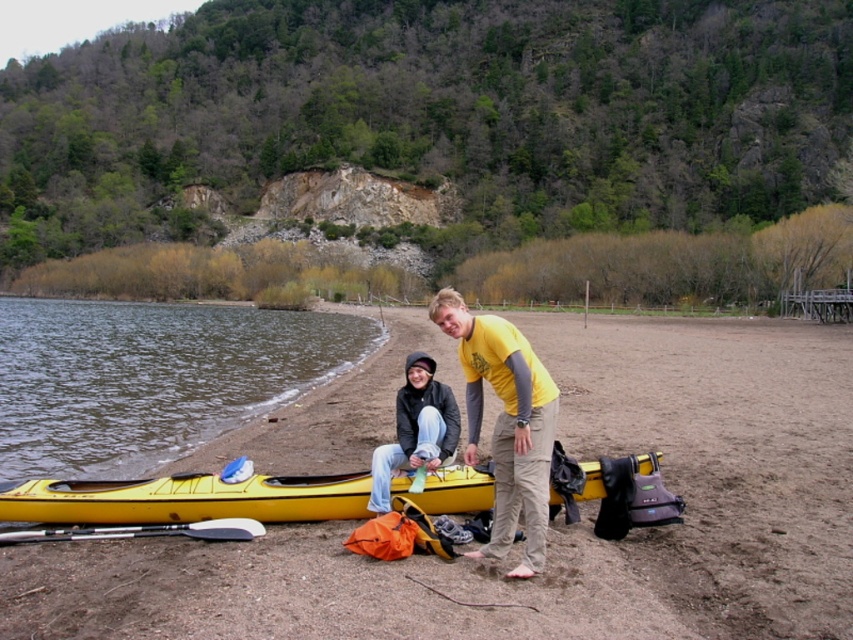
Question: Is brown sandy beach at lower center to the right of yellow plastic water at lower left from the viewer's perspective?

Choices:
 (A) yes
 (B) no

Answer: (A)

Question: Is brown sandy beach at lower center to the left of jeans at center from the viewer's perspective?

Choices:
 (A) no
 (B) yes

Answer: (A)

Question: Based on their relative distances, which object is farther from the matte yellow kayak at center?

Choices:
 (A) yellow matte kayak at lower left
 (B) brown sandy beach at lower center

Answer: (B)

Question: Is yellow matte kayak at lower left wider than matte yellow kayak at center?

Choices:
 (A) yes
 (B) no

Answer: (A)

Question: Based on their relative distances, which object is nearer to the yellow plastic water at lower left?

Choices:
 (A) jeans at center
 (B) yellow matte kayak at lower left
 (C) matte yellow kayak at center

Answer: (B)

Question: Estimate the real-world distances between objects in this image. Which object is farther from the yellow plastic water at lower left?

Choices:
 (A) brown sandy beach at lower center
 (B) yellow matte kayak at lower left
 (C) matte yellow kayak at center
 (D) jeans at center

Answer: (D)